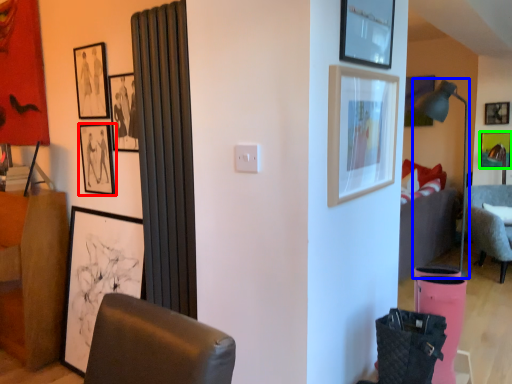
Question: Based on their relative distances, which object is farther from picture frame (highlighted by a red box)? Choose from lamp (highlighted by a blue box) and picture frame (highlighted by a green box).

Choices:
 (A) lamp
 (B) picture frame

Answer: (B)